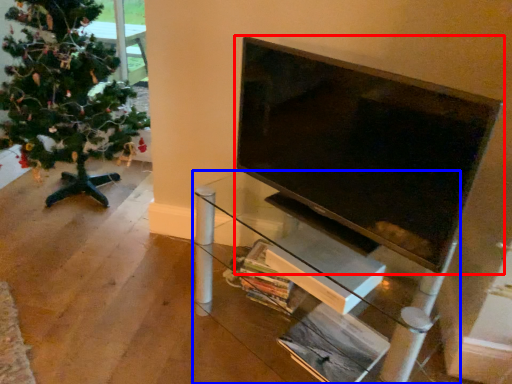
Question: Which point is closer to the camera, television (highlighted by a red box) or furniture (highlighted by a blue box)?

Choices:
 (A) television
 (B) furniture

Answer: (A)